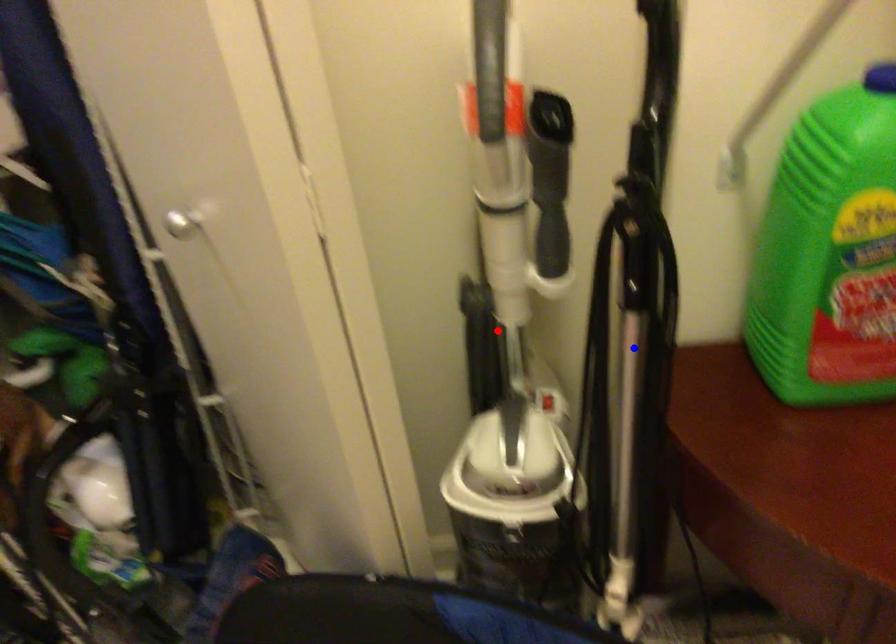
Question: Which of the two points in the image is closer to the camera?

Choices:
 (A) Blue point is closer.
 (B) Red point is closer.

Answer: (A)